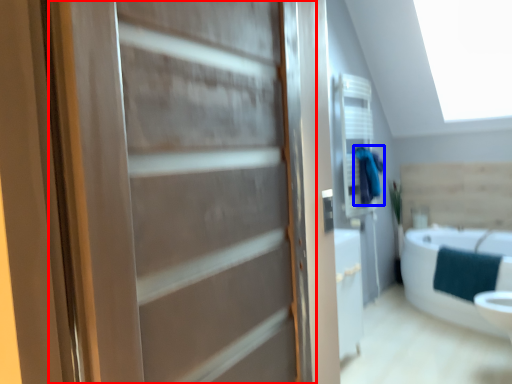
Question: Which object appears farthest to the camera in this image, door (highlighted by a red box) or bathrobe (highlighted by a blue box)?

Choices:
 (A) door
 (B) bathrobe

Answer: (B)